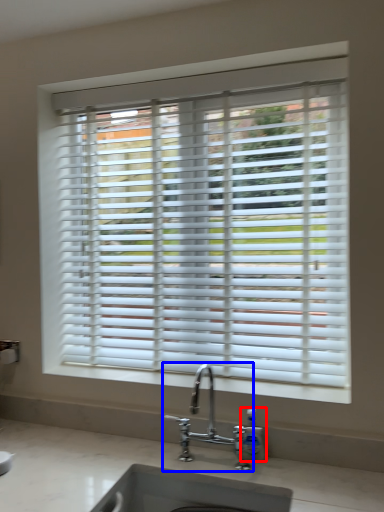
Question: Which of the following is the closest to the observer, soap dispenser (highlighted by a red box) or tap (highlighted by a blue box)?

Choices:
 (A) soap dispenser
 (B) tap

Answer: (B)